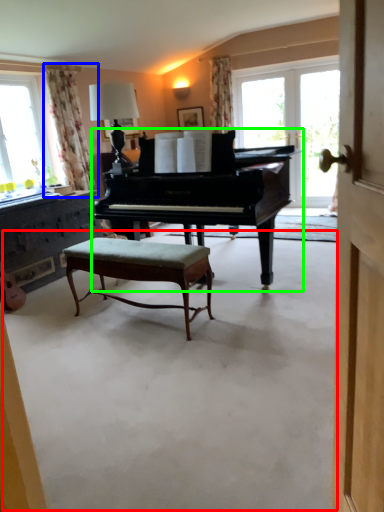
Question: Considering the real-world distances, which object is farthest from concrete (highlighted by a red box)? curtain (highlighted by a blue box) or piano (highlighted by a green box)?

Choices:
 (A) curtain
 (B) piano

Answer: (A)